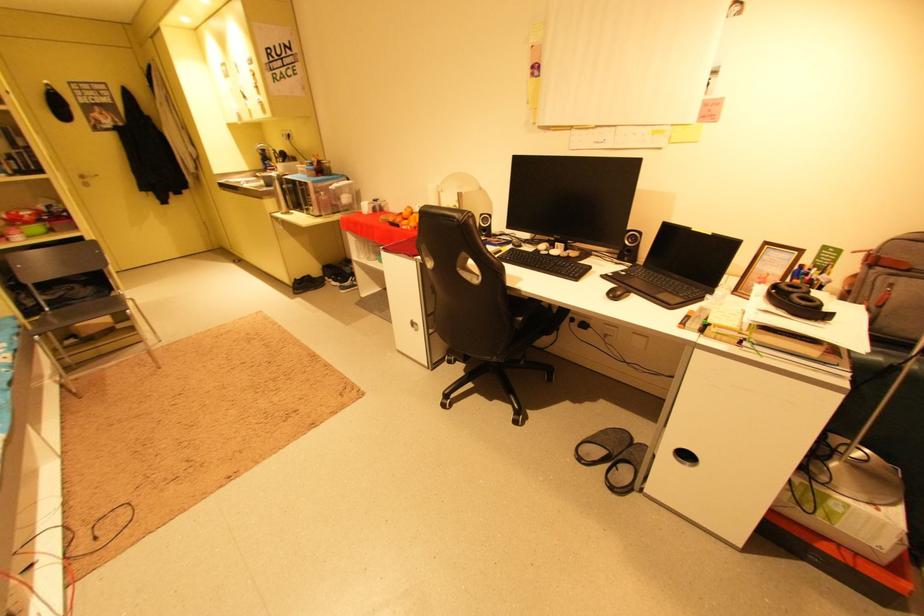
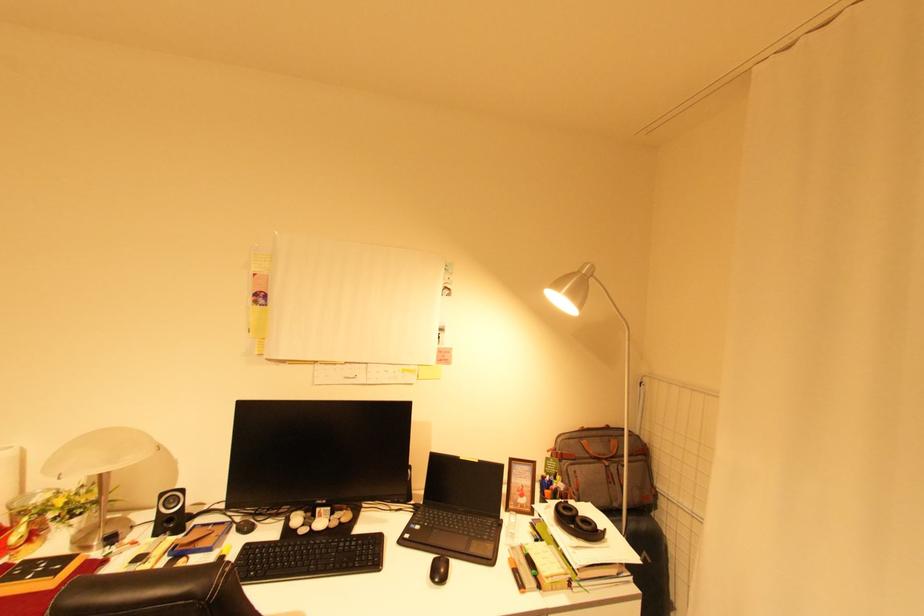
The first image is from the beginning of the video and the second image is from the end. How did the camera likely rotate when shooting the video?

The camera rotated toward right-up.